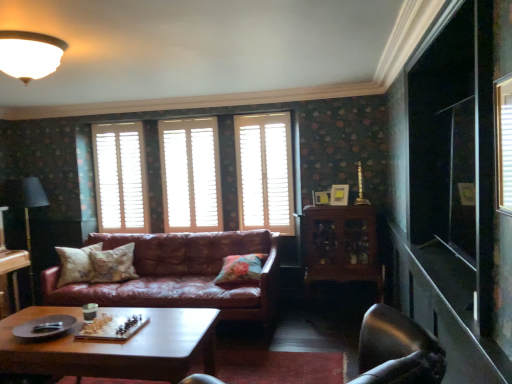
Locate an element on the screen. free space above wooden chess set at center (from a real-world perspective) is located at coordinates (116, 330).